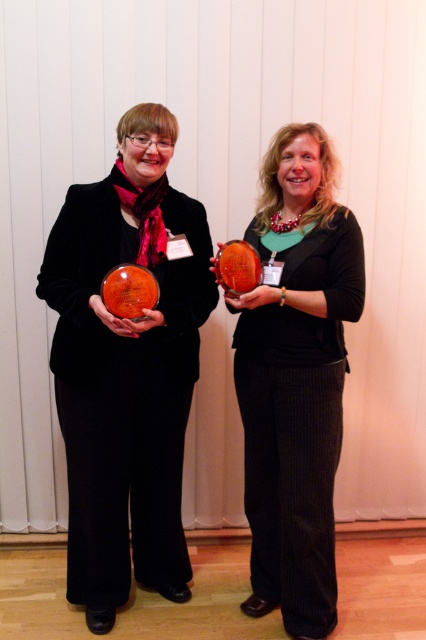
Between point (71, 600) and point (304, 378), which one is positioned behind?

Point (71, 600)

Between matte orange glass bowl at center and matte orange trophy at center, which one appears on the left side from the viewer's perspective?

matte orange glass bowl at center is more to the left.

I want to click on matte orange glass bowl at center, so click(126, 369).